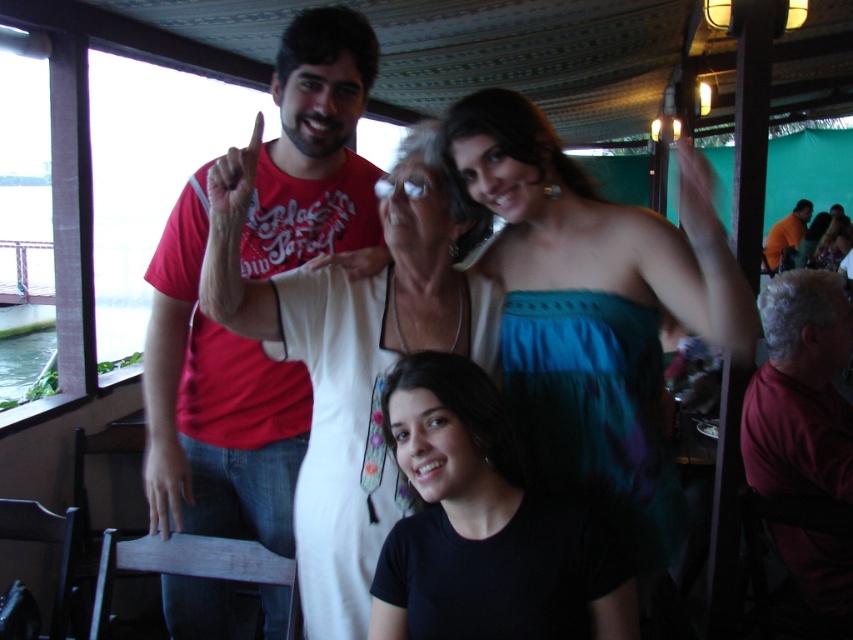
Question: Considering the relative positions of matte red t-shirt at upper left and orange fabric shirt at upper right in the image provided, where is matte red t-shirt at upper left located with respect to orange fabric shirt at upper right?

Choices:
 (A) above
 (B) below

Answer: (B)

Question: Which point is farther to the camera?

Choices:
 (A) (430, 298)
 (B) (187, 298)

Answer: (B)

Question: Which object appears closest to the camera in this image?

Choices:
 (A) orange fabric shirt at upper right
 (B) teal fabric dress at upper center
 (C) matte red t-shirt at upper left

Answer: (B)

Question: Can you confirm if teal fabric dress at upper center is thinner than white fabric dress at center?

Choices:
 (A) yes
 (B) no

Answer: (B)

Question: Is black matte shirt at center wider than orange fabric shirt at upper right?

Choices:
 (A) yes
 (B) no

Answer: (B)

Question: Which point appears farthest from the camera in this image?

Choices:
 (A) (207, 189)
 (B) (701, 216)
 (C) (795, 225)
 (D) (421, 529)

Answer: (C)